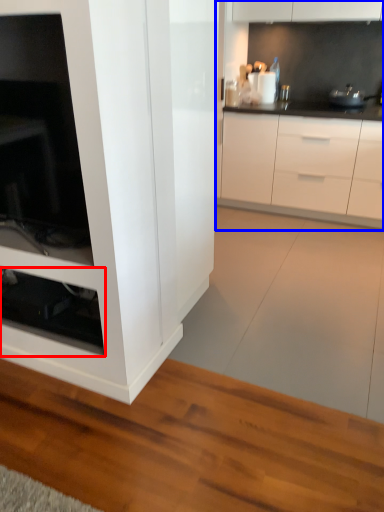
Question: Which object appears farthest to the camera in this image, shelf (highlighted by a red box) or cabinetry (highlighted by a blue box)?

Choices:
 (A) shelf
 (B) cabinetry

Answer: (B)